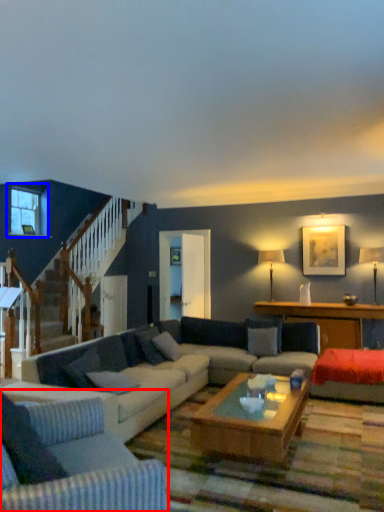
Question: Which of the following is the closest to the observer, studio couch (highlighted by a red box) or window (highlighted by a blue box)?

Choices:
 (A) studio couch
 (B) window

Answer: (A)